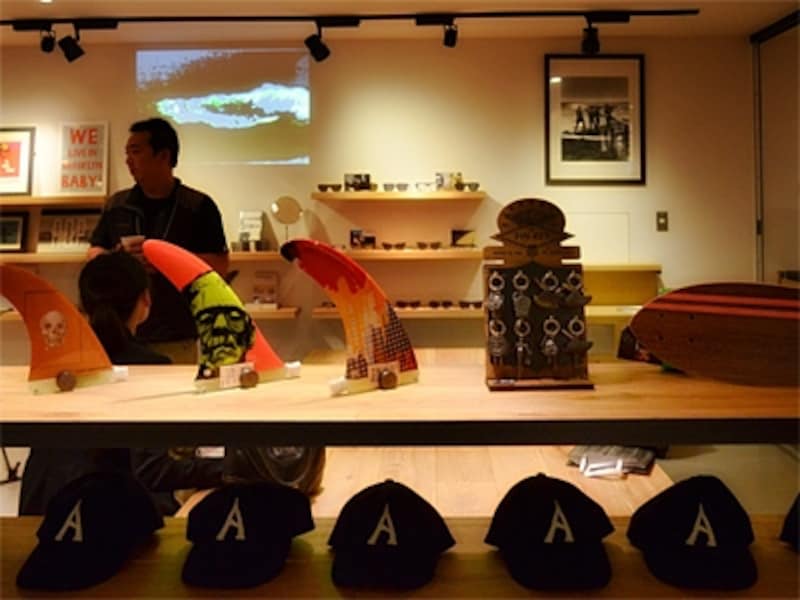
Identify the location of floor. (442, 465).